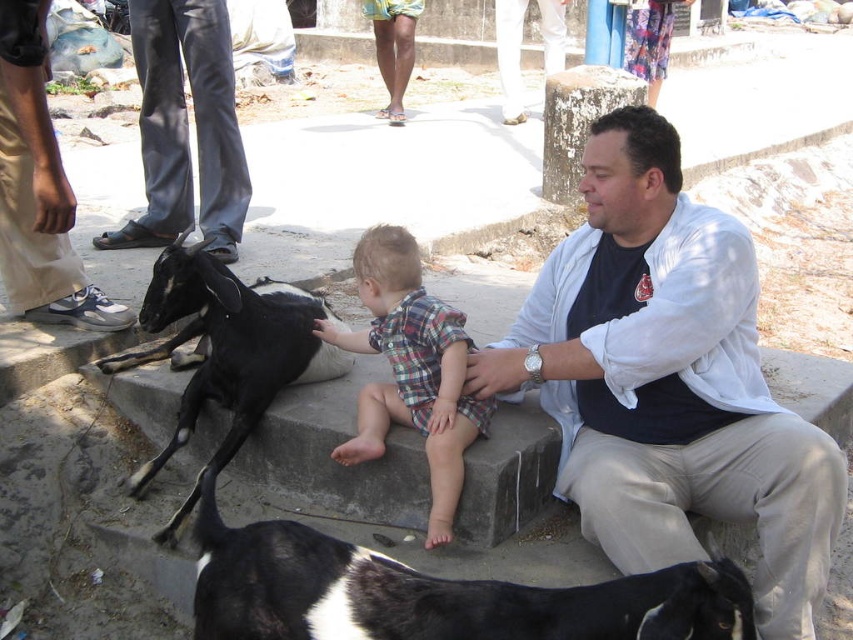
Question: Which point is closer to the camera?

Choices:
 (A) (48, 288)
 (B) (144, 310)
 (C) (241, 552)
 (D) (715, 372)

Answer: (C)

Question: Among these objects, which one is nearest to the camera?

Choices:
 (A) black and white fur at lower center
 (B) matte white shirt at center

Answer: (A)

Question: Among these objects, which one is nearest to the camera?

Choices:
 (A) black glossy goat at center
 (B) plaid fabric baby at center
 (C) matte white shirt at center
 (D) black and white fur at lower center

Answer: (D)

Question: Can you confirm if black leather pants at left is smaller than plaid fabric baby at center?

Choices:
 (A) no
 (B) yes

Answer: (A)

Question: Is matte white shirt at center in front of black and white fur at lower center?

Choices:
 (A) yes
 (B) no

Answer: (B)

Question: Can you confirm if matte white shirt at center is positioned above matte black goat at left?

Choices:
 (A) yes
 (B) no

Answer: (B)